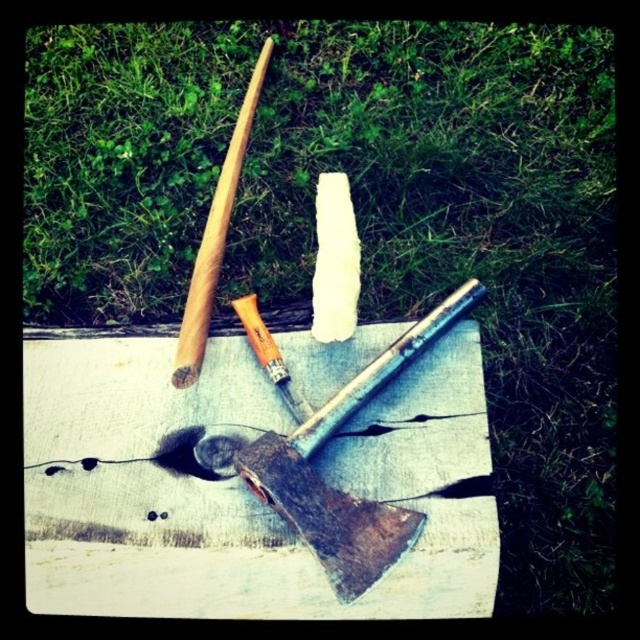
Between smooth wooden board at center and wooden baseball bat at upper left, which one has more height?

wooden baseball bat at upper left

Is smooth wooden board at center shorter than wooden baseball bat at upper left?

Yes.

Is point (172, 344) closer to viewer compared to point (205, 234)?

Yes.

Find the location of a particular element. Image resolution: width=640 pixels, height=640 pixels. smooth wooden board at center is located at coordinates (240, 486).

Can you confirm if wooden baseball bat at upper left is thinner than white plastic blade at center?

No, wooden baseball bat at upper left is not thinner than white plastic blade at center.

Between point (186, 372) and point (330, 276), which one is positioned in front?

Point (186, 372)

You are a GUI agent. You are given a task and a screenshot of the screen. Output one action in this format:
    pyautogui.click(x=<x>, y=<y>)
    Task: Click on the wooden baseball bat at upper left
    
    Given the screenshot: What is the action you would take?
    pyautogui.click(x=216, y=237)

Is smooth wooden board at center to the right of white plastic blade at center from the viewer's perspective?

Incorrect, smooth wooden board at center is not on the right side of white plastic blade at center.

Does smooth wooden board at center have a greater height compared to white plastic blade at center?

Yes.

Which is behind, point (362, 616) or point (339, 189)?

The point (339, 189) is more distant.

Locate an element on the screen. smooth wooden board at center is located at coordinates (240, 486).